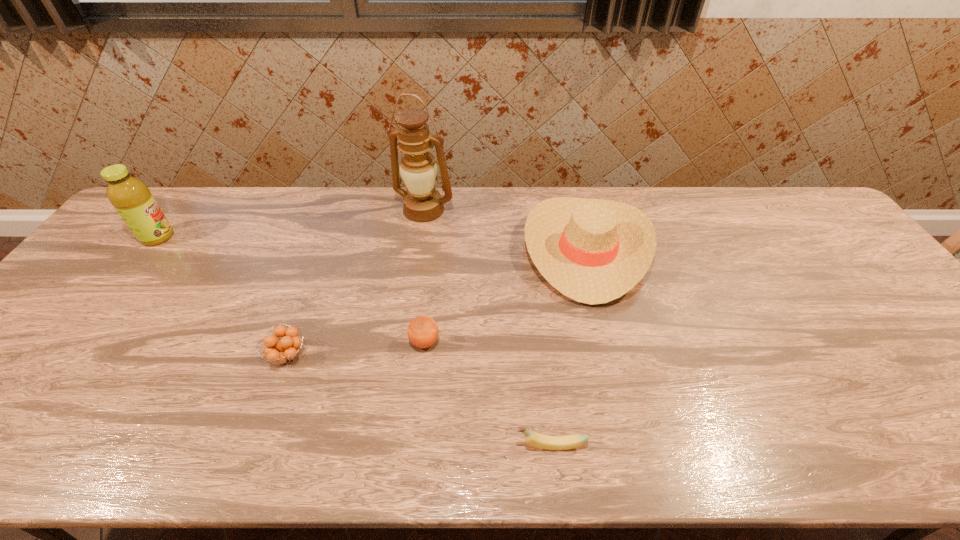
This screenshot has width=960, height=540. In order to click on free space located 0.240m on the left of the right orange fruit in this screenshot , I will do `click(312, 342)`.

The image size is (960, 540). I want to click on vacant space positioned on the right of the fifth object from right to left, so click(363, 355).

You are a GUI agent. You are given a task and a screenshot of the screen. Output one action in this format:
    pyautogui.click(x=<x>, y=<y>)
    Task: Click on the vacant area located at the stem of the banana
    
    Given the screenshot: What is the action you would take?
    pyautogui.click(x=393, y=445)

Identify the location of free space located 0.240m at the stem of the banana. (397, 445).

At what (x,y) coordinates should I click in order to perform the action: click on vacant space located 0.380m at the stem of the banana. Please return your answer as a coordinate pair (x, y). The image size is (960, 540). Looking at the image, I should click on (329, 445).

You are a GUI agent. You are given a task and a screenshot of the screen. Output one action in this format:
    pyautogui.click(x=<x>, y=<y>)
    Task: Click on the oil lamp that is at the far edge
    This screenshot has width=960, height=540.
    Given the screenshot: What is the action you would take?
    pyautogui.click(x=422, y=202)

Locate an element on the screen. fruit juice that is at the far edge is located at coordinates (132, 199).

Image resolution: width=960 pixels, height=540 pixels. What are the coordinates of `sunhat located in the far edge section of the desktop` in the screenshot? It's located at (594, 251).

Identify the location of object situated at the near edge. (537, 440).

I want to click on object that is at the left edge, so click(x=132, y=199).